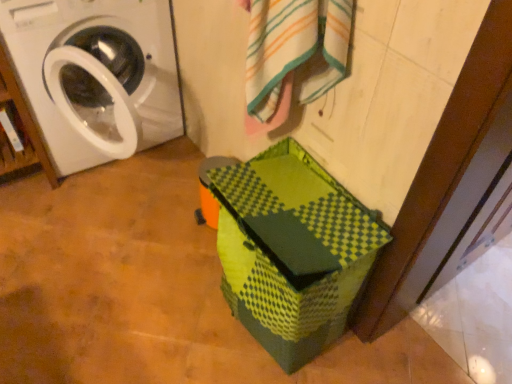
Question: From a real-world perspective, relative to green matte cardboard box at lower center, is white glossy washing machine at left vertically above or below?

Choices:
 (A) below
 (B) above

Answer: (B)

Question: From their relative heights in the image, would you say white glossy washing machine at left is taller or shorter than green matte cardboard box at lower center?

Choices:
 (A) short
 (B) tall

Answer: (B)

Question: Which of these objects is positioned closest to the white striped bath towel at upper center?

Choices:
 (A) matte white washing machine at left
 (B) white glossy washing machine at left
 (C) green matte cardboard box at lower center

Answer: (C)

Question: Estimate the real-world distances between objects in this image. Which object is farther from the matte white washing machine at left?

Choices:
 (A) white glossy washing machine at left
 (B) white striped bath towel at upper center
 (C) green matte cardboard box at lower center

Answer: (C)